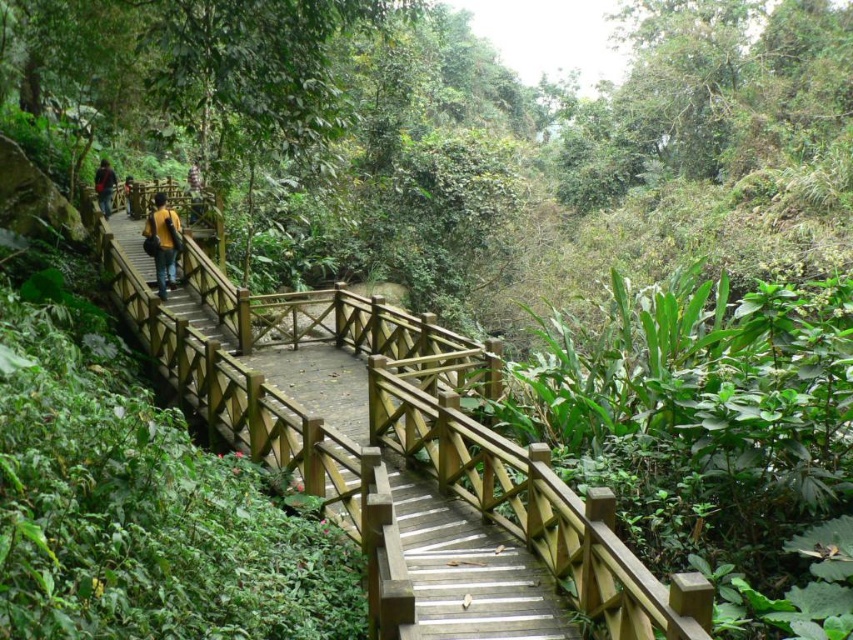
Looking at this image, does dark blue jeans at center have a larger size compared to dark brown leather jacket at upper left?

No, dark blue jeans at center is not bigger than dark brown leather jacket at upper left.

Is point (201, 196) closer to viewer compared to point (131, 176)?

Yes, it is.

Locate an element on the screen. dark blue jeans at center is located at coordinates (194, 189).

Which of these two, yellow matte jacket at center or dark brown leather jacket at upper left, stands shorter?

dark brown leather jacket at upper left is shorter.

Who is positioned more to the right, yellow matte jacket at center or dark brown leather jacket at upper left?

From the viewer's perspective, yellow matte jacket at center appears more on the right side.

Based on the photo, who is more distant from viewer, (169,259) or (125,188)?

The point (125,188) is more distant.

You are a GUI agent. You are given a task and a screenshot of the screen. Output one action in this format:
    pyautogui.click(x=<x>, y=<y>)
    Task: Click on the yellow matte jacket at center
    
    Given the screenshot: What is the action you would take?
    pyautogui.click(x=161, y=243)

Who is lower down, yellow matte jacket at center or matte black backpack at left?

Positioned lower is yellow matte jacket at center.

Does yellow matte jacket at center appear on the right side of matte black backpack at left?

Correct, you'll find yellow matte jacket at center to the right of matte black backpack at left.

Who is more forward, (167, 252) or (103, 186)?

Positioned in front is point (167, 252).

The width and height of the screenshot is (853, 640). What are the coordinates of `yellow matte jacket at center` in the screenshot? It's located at (161, 243).